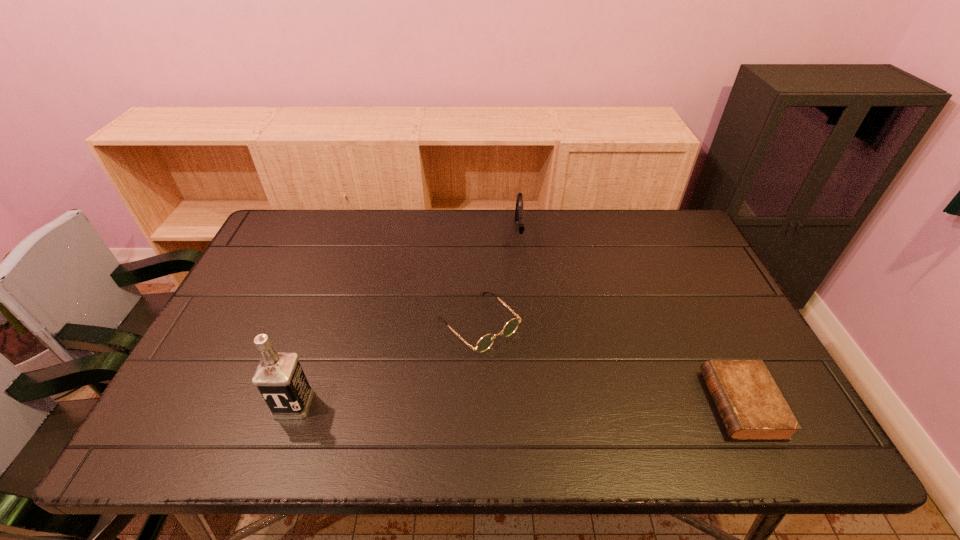
Locate an element on the screen. This screenshot has height=540, width=960. vacant point located between the second object from left to right and the leftmost object is located at coordinates (387, 364).

Locate an element on the screen. Image resolution: width=960 pixels, height=540 pixels. free space between the third shortest object and the spectacles is located at coordinates (499, 279).

Identify the location of free space between the gun and the diary. (631, 319).

Where is `empty space between the spectacles and the farthest object`? The height and width of the screenshot is (540, 960). empty space between the spectacles and the farthest object is located at coordinates (499, 279).

What are the coordinates of `free area in between the second shortest object and the tallest object` in the screenshot? It's located at (387, 364).

Identify the location of empty location between the third object from left to right and the shortest object. This screenshot has width=960, height=540. (631, 319).

Identify which object is located as the nearest to the tallest object. Please provide its 2D coordinates. Your answer should be formatted as a tuple, i.e. [(x, y)], where the tuple contains the x and y coordinates of a point satisfying the conditions above.

[(485, 342)]

Where is `the second closest object relative to the third shortest object`? This screenshot has width=960, height=540. the second closest object relative to the third shortest object is located at coordinates (750, 404).

Locate an element on the screen. The image size is (960, 540). vacant area in the image that satisfies the following two spatial constraints: 1. on the front side of the shortest object; 2. on the spine side of the second tallest object is located at coordinates (538, 404).

Identify the location of free space in the image that satisfies the following two spatial constraints: 1. on the back side of the second shortest object; 2. on the right side of the third shortest object. (479, 233).